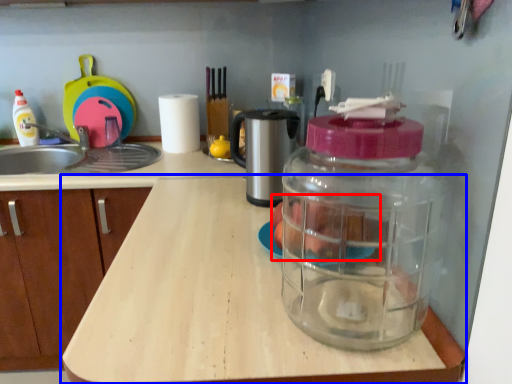
Question: Among these objects, which one is farthest to the camera, food (highlighted by a red box) or countertop (highlighted by a blue box)?

Choices:
 (A) food
 (B) countertop

Answer: (A)